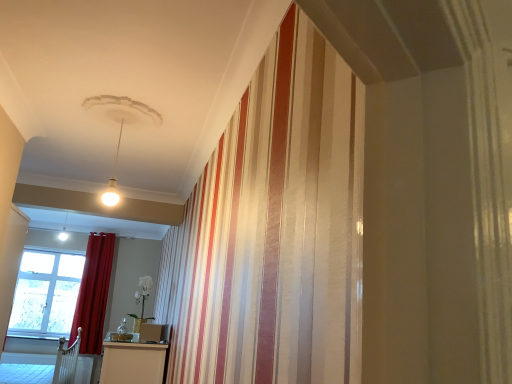
Question: Considering the positions of point (74, 339) and point (25, 329), is point (74, 339) closer or farther from the camera than point (25, 329)?

Choices:
 (A) farther
 (B) closer

Answer: (A)

Question: Is velvet red curtain at left in front of or behind clear glass window at lower left in the image?

Choices:
 (A) behind
 (B) front

Answer: (B)

Question: From the image's perspective, is velvet red curtain at left located above or below clear glass window at lower left?

Choices:
 (A) below
 (B) above

Answer: (B)

Question: Based on their positions, is clear glass window at lower left located to the left or right of velvet red curtain at left?

Choices:
 (A) left
 (B) right

Answer: (A)

Question: From the image's perspective, is clear glass window at lower left above or below velvet red curtain at left?

Choices:
 (A) above
 (B) below

Answer: (B)

Question: Looking at the image, does clear glass window at lower left seem bigger or smaller compared to velvet red curtain at left?

Choices:
 (A) small
 (B) big

Answer: (A)

Question: Is clear glass window at lower left wider or thinner than velvet red curtain at left?

Choices:
 (A) wide
 (B) thin

Answer: (B)